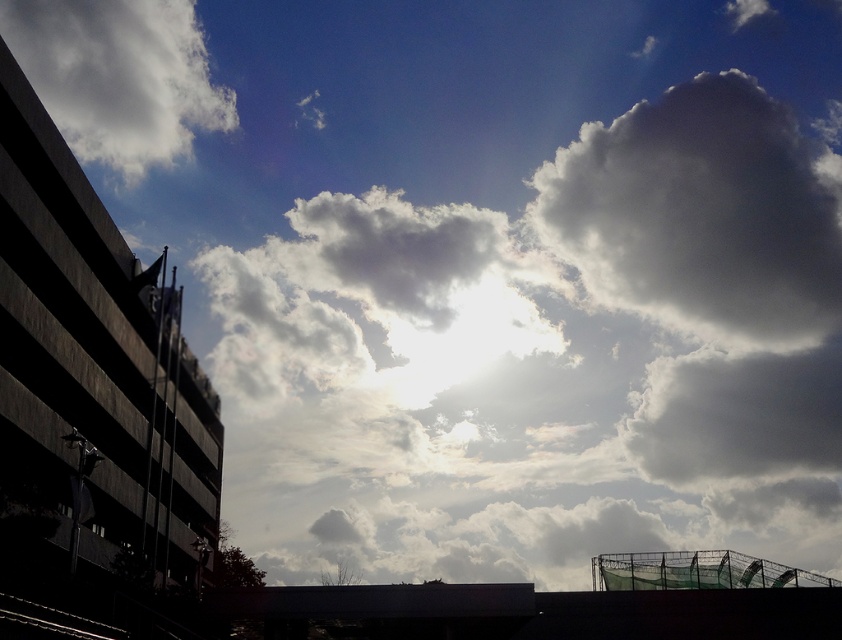
Which is more to the right, white fluffy cloud at upper right or green netting at lower right?

white fluffy cloud at upper right

Which is more to the left, white fluffy cloud at upper right or green netting at lower right?

From the viewer's perspective, green netting at lower right appears more on the left side.

Measure the distance between white fluffy cloud at upper right and camera.

white fluffy cloud at upper right and camera are 235.56 meters apart from each other.

Where is `white fluffy cloud at upper right`? white fluffy cloud at upper right is located at coordinates (701, 214).

Is white fluffy cloud at upper center to the left of white fluffy cloud at upper right from the viewer's perspective?

Yes, white fluffy cloud at upper center is to the left of white fluffy cloud at upper right.

Image resolution: width=842 pixels, height=640 pixels. Describe the element at coordinates (549, 356) in the screenshot. I see `white fluffy cloud at upper center` at that location.

What do you see at coordinates (549, 356) in the screenshot?
I see `white fluffy cloud at upper center` at bounding box center [549, 356].

Identify the location of white fluffy cloud at upper center. This screenshot has height=640, width=842. (549, 356).

Between white fluffy cloud at upper right and white fluffy cloud at upper left, which one is positioned higher?

Positioned higher is white fluffy cloud at upper left.

Measure the distance between point [798,227] and camera.

Point [798,227] is 269.30 meters away from camera.

You are a GUI agent. You are given a task and a screenshot of the screen. Output one action in this format:
    pyautogui.click(x=<x>, y=<y>)
    Task: Click on the white fluffy cloud at upper right
    
    Given the screenshot: What is the action you would take?
    pyautogui.click(x=701, y=214)